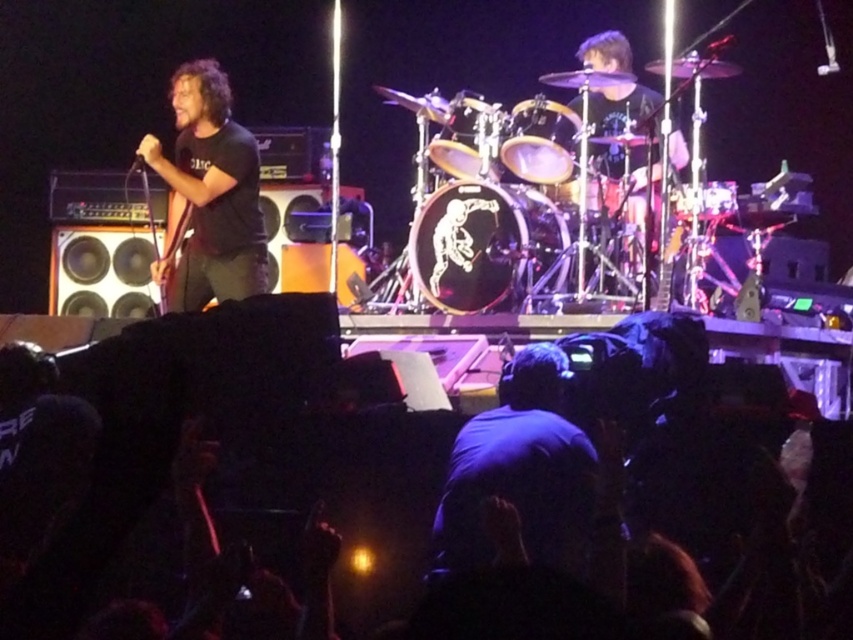
You are standing at the point marked as point (218, 228), which is 9.67 meters away from the camera. You want to throw a water balloon to hit the drummer in the center of the stage. Is the drummer within your throwing range if your maximum throw distance is 10 meters?

The drummer is at the center of the stage, and the point (218, 228) is 9.67 meters away from the camera. Since your maximum throw distance is 10 meters, you can reach the drummer as 9.67 meters is within your range.

You are a photographer at the back of the venue. You want to take a photo of the black matte shirt at left and the shiny gold drum at center. Can you see both objects clearly in the same frame without any obstruction?

Answer: The shiny gold drum at center is behind the black matte shirt at left, so the black matte shirt at left will block the view of the shiny gold drum at center. Therefore, you cannot see both objects clearly in the same frame without obstruction.

You are a photographer at the back of the venue. You notice a point at coordinates (209, 195) on the black matte shirt at left. Is this point closer to the center of the stage or the edge?

The point at coordinates (209, 195) is on the black matte shirt at left. Since the shirt belongs to the performer at the left side of the stage, this point is closer to the edge of the stage rather than the center.